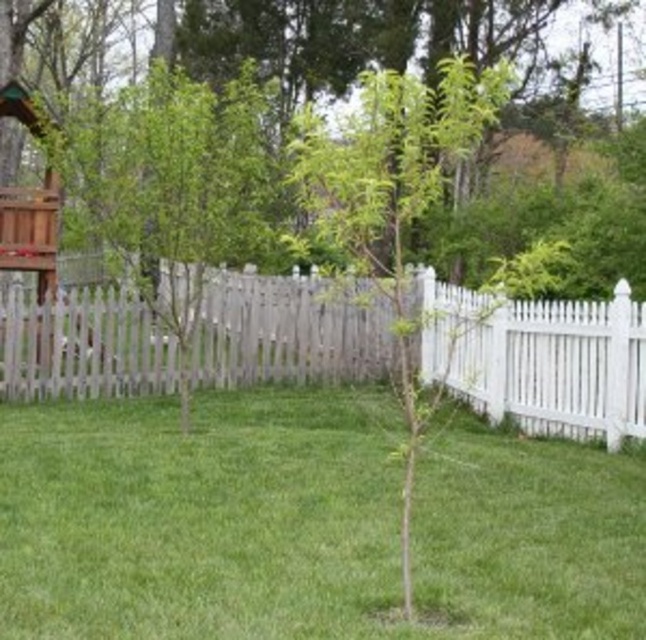
Question: Among these points, which one is nearest to the camera?

Choices:
 (A) (388, 490)
 (B) (118, 269)

Answer: (A)

Question: Is green grass at center closer to camera compared to green leafy tree at center?

Choices:
 (A) yes
 (B) no

Answer: (A)

Question: Among these points, which one is nearest to the camera?

Choices:
 (A) (171, 88)
 (B) (123, 624)

Answer: (B)

Question: Which point is closer to the camera taking this photo?

Choices:
 (A) (605, 598)
 (B) (178, 160)

Answer: (A)

Question: Does green grass at center have a greater width compared to green leafy tree at center?

Choices:
 (A) yes
 (B) no

Answer: (B)

Question: Is green grass at center thinner than green leafy tree at center?

Choices:
 (A) no
 (B) yes

Answer: (B)